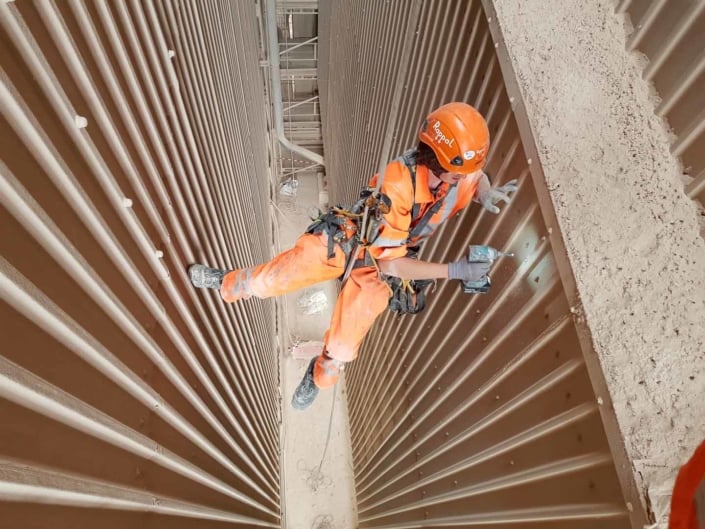
Where is `beam covers`? The height and width of the screenshot is (529, 705). beam covers is located at coordinates (127, 203), (80, 122), (158, 253).